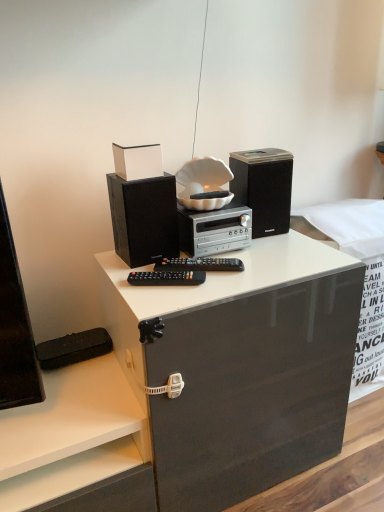
Question: From a real-world perspective, is black plastic remote control at center located beneath black matte speaker at left, the first speaker in the left-to-right sequence?

Choices:
 (A) yes
 (B) no

Answer: (A)

Question: Is black plastic remote control at center not close to black matte speaker at left, which ranks as the 2th speaker in right-to-left order?

Choices:
 (A) yes
 (B) no

Answer: (B)

Question: Is black plastic remote control at center directly adjacent to black matte speaker at left, which ranks as the 2th speaker in right-to-left order?

Choices:
 (A) yes
 (B) no

Answer: (B)

Question: Is black plastic remote control at center looking in the opposite direction of black matte speaker at left, which ranks as the 2th speaker in right-to-left order?

Choices:
 (A) yes
 (B) no

Answer: (A)

Question: Is black plastic remote control at center at the right side of black matte speaker at left, which ranks as the 2th speaker in right-to-left order?

Choices:
 (A) yes
 (B) no

Answer: (A)

Question: Is point (271, 159) positioned closer to the camera than point (145, 206)?

Choices:
 (A) closer
 (B) farther

Answer: (B)

Question: Considering their positions, is black matte speaker at upper right, arranged as the first speaker when viewed from the right, located in front of or behind black matte speaker at left, which ranks as the 2th speaker in right-to-left order?

Choices:
 (A) front
 (B) behind

Answer: (B)

Question: Looking at the image, does black matte speaker at upper right, arranged as the first speaker when viewed from the right, seem bigger or smaller compared to black matte speaker at left, the first speaker in the left-to-right sequence?

Choices:
 (A) small
 (B) big

Answer: (B)

Question: Is black matte speaker at upper right, arranged as the first speaker when viewed from the right, inside or outside of black matte speaker at left, which ranks as the 2th speaker in right-to-left order?

Choices:
 (A) outside
 (B) inside

Answer: (A)

Question: Is point (226, 261) closer or farther from the camera than point (119, 189)?

Choices:
 (A) farther
 (B) closer

Answer: (A)

Question: From a real-world perspective, is black plastic remote control at center positioned above or below black matte speaker at left, the first speaker in the left-to-right sequence?

Choices:
 (A) above
 (B) below

Answer: (B)

Question: Is black plastic remote control at center to the left or to the right of black matte speaker at left, which ranks as the 2th speaker in right-to-left order, in the image?

Choices:
 (A) right
 (B) left

Answer: (A)

Question: In terms of width, does black plastic remote control at center look wider or thinner when compared to black matte speaker at left, which ranks as the 2th speaker in right-to-left order?

Choices:
 (A) thin
 (B) wide

Answer: (A)

Question: From the image's perspective, is silver metallic stereo at center located above or below black plastic remote control at center?

Choices:
 (A) below
 (B) above

Answer: (B)

Question: Is silver metallic stereo at center in front of or behind black plastic remote control at center in the image?

Choices:
 (A) behind
 (B) front

Answer: (A)